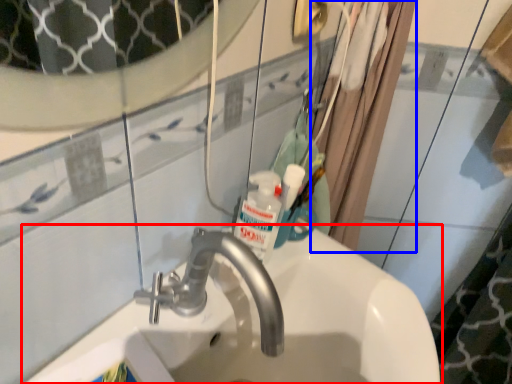
Question: Among these objects, which one is nearest to the camera, sink (highlighted by a red box) or shower curtain (highlighted by a blue box)?

Choices:
 (A) sink
 (B) shower curtain

Answer: (A)